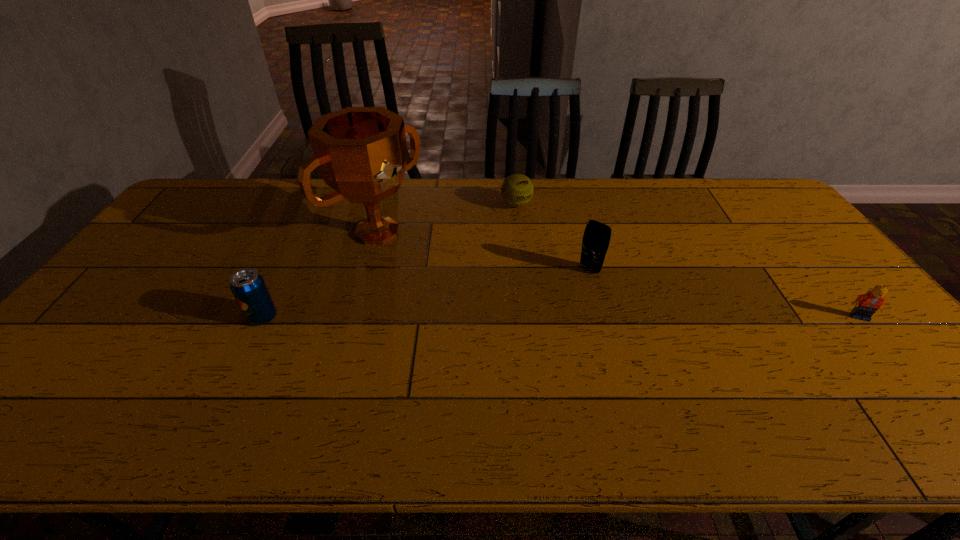
Locate an element on the screen. The width and height of the screenshot is (960, 540). free spot on the desktop that is between the third shortest object and the Lego and is positioned on the screen of the cellular telephone is located at coordinates (547, 316).

The height and width of the screenshot is (540, 960). In order to click on vacant space on the desktop that is between the pop soda and the rightmost object and is positioned on the logo side of the softball in this screenshot , I will do `click(627, 316)`.

You are a GUI agent. You are given a task and a screenshot of the screen. Output one action in this format:
    pyautogui.click(x=<x>, y=<y>)
    Task: Click on the vacant space on the desktop that is between the pop soda and the rightmost object and is positioned on the side of the tallest object with the star emblem
    
    Given the screenshot: What is the action you would take?
    pyautogui.click(x=492, y=316)